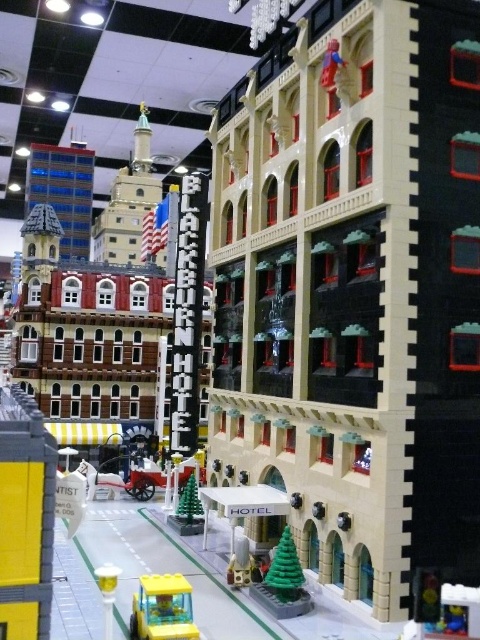
Is green matte christmas tree at center to the left of matte gray statue at center from the viewer's perspective?

Correct, you'll find green matte christmas tree at center to the left of matte gray statue at center.

The image size is (480, 640). Find the location of `green matte christmas tree at center`. green matte christmas tree at center is located at coordinates point(188,509).

Between point (195, 500) and point (240, 566), which one is positioned in front?

Point (240, 566) is in front.

Where is `green matte christmas tree at center`? The height and width of the screenshot is (640, 480). green matte christmas tree at center is located at coordinates (188, 509).

Who is higher up, translucent yellow plastic car at lower left or matte gray statue at center?

translucent yellow plastic car at lower left

Does translucent yellow plastic car at lower left appear over matte gray statue at center?

Yes.

Image resolution: width=480 pixels, height=640 pixels. Identify the location of translucent yellow plastic car at lower left. (163, 609).

Can you confirm if translucent yellow plastic car at lower left is positioned to the left of green plastic christmas tree at lower center?

Yes, translucent yellow plastic car at lower left is to the left of green plastic christmas tree at lower center.

What do you see at coordinates (163, 609) in the screenshot?
I see `translucent yellow plastic car at lower left` at bounding box center [163, 609].

Identify the location of translucent yellow plastic car at lower left. (163, 609).